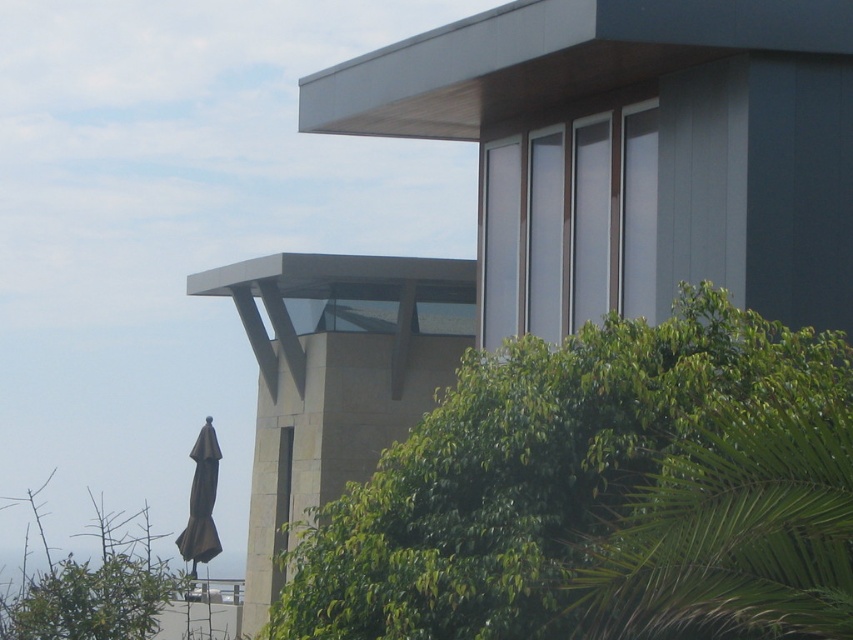
Question: Which object is the closest to the green leafy palm tree at lower right?

Choices:
 (A) brown matte umbrella at lower left
 (B) green leafy tree at center

Answer: (B)

Question: Can you confirm if green leafy tree at center is positioned to the right of brown matte umbrella at lower left?

Choices:
 (A) no
 (B) yes

Answer: (B)

Question: Among these objects, which one is nearest to the camera?

Choices:
 (A) green leafy palm tree at lower right
 (B) green leafy tree at center
 (C) brown matte umbrella at lower left

Answer: (A)

Question: Considering the relative positions of green leafy tree at center and green leafy palm tree at lower right in the image provided, where is green leafy tree at center located with respect to green leafy palm tree at lower right?

Choices:
 (A) below
 (B) above

Answer: (B)

Question: Observing the image, what is the correct spatial positioning of green leafy palm tree at lower right in reference to brown matte umbrella at lower left?

Choices:
 (A) above
 (B) below

Answer: (A)

Question: Which object is the closest to the green leafy tree at center?

Choices:
 (A) brown matte umbrella at lower left
 (B) green leafy palm tree at lower right

Answer: (B)